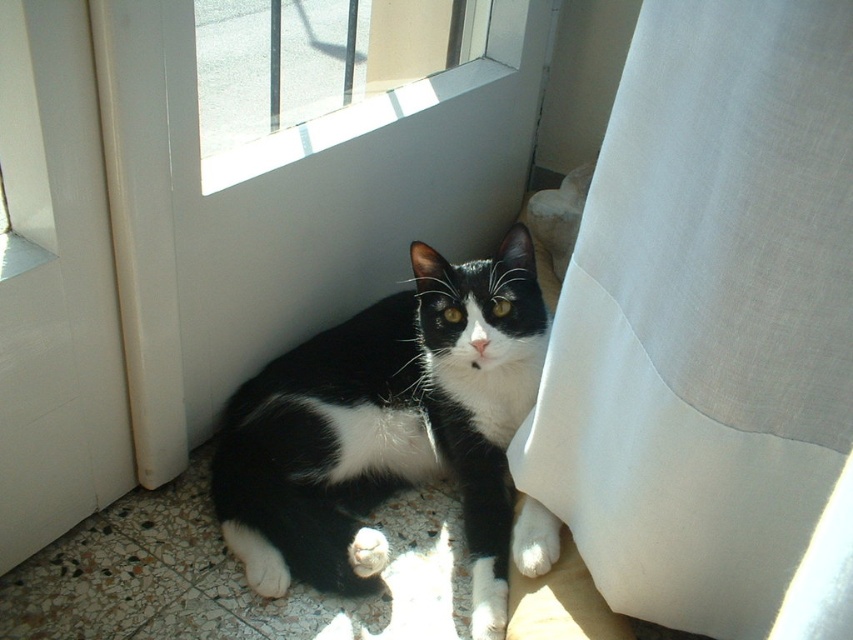
You are a small robot with a width of 10 inches. You need to move from the white sheer curtain at lower right to the black and white fur cat at center. Can you fit through the space between them?

The distance between the white sheer curtain at lower right and the black and white fur cat at center is 10.99 inches. Since the robot is 10 inches wide, it can fit through the space between them as there is enough clearance.

You are a delivery person with a package that requires a signature. The doorbell is broken, so you need to enter through the white plastic screen door at upper center. However, the cat, black and white fur cat at center, is blocking the path. Can you step over the cat without touching it to reach the door?

The white plastic screen door at upper center is 10.56 inches away from the black and white fur cat at center. Since the distance is sufficient, you can step over the cat without touching it to reach the door.

You are a delivery person trying to enter the house through the white plastic screen door at upper center. The black and white fur cat at center is blocking your path. Can you step over the cat without opening the door?

The white plastic screen door at upper center is much taller than the black and white fur cat at center, so you can step over the cat without opening the door since the door is higher.